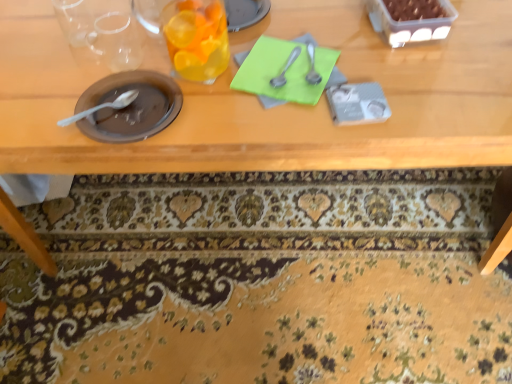
Image resolution: width=512 pixels, height=384 pixels. Describe the element at coordinates (287, 71) in the screenshot. I see `green paper at center` at that location.

What do you see at coordinates (312, 66) in the screenshot? I see `satin silver spoon at upper center, the 4th tableware when ordered from left to right` at bounding box center [312, 66].

The width and height of the screenshot is (512, 384). Describe the element at coordinates (196, 38) in the screenshot. I see `translucent glass at upper center, which is the 3th tableware from right to left` at that location.

Measure the distance between point (292, 112) and camera.

A distance of 29.17 inches exists between point (292, 112) and camera.

Find the location of a particular element. green paper at center is located at coordinates (287, 71).

Is satin silver spoon at upper center, the first tableware in the right-to-left sequence, closer to the viewer compared to matte brown plate at left, the fourth tableware viewed from the right?

No.

At what (x,y) coordinates should I click in order to perform the action: click on tableware that is the 2nd one when counting forward from the satin silver spoon at upper center, the first tableware in the right-to-left sequence. Please return your answer as a coordinate pair (x, y). This screenshot has width=512, height=384. Looking at the image, I should click on (130, 107).

Is satin silver spoon at upper center, the 4th tableware when ordered from left to right, to the left or to the right of matte brown plate at left, the first tableware viewed from the left, in the image?

Clearly, satin silver spoon at upper center, the 4th tableware when ordered from left to right, is on the right of matte brown plate at left, the first tableware viewed from the left, in the image.

Can translucent glass at upper center, the second tableware when ordered from left to right, be found inside wooden table at center?

Definitely not — translucent glass at upper center, the second tableware when ordered from left to right, is not inside wooden table at center.

From a real-world perspective, who is located lower, wooden table at center or translucent glass at upper center, the second tableware when ordered from left to right?

wooden table at center is physically lower.

Between wooden table at center and translucent glass at upper center, the second tableware when ordered from left to right, which one appears on the right side from the viewer's perspective?

wooden table at center is more to the right.

Is green paper at center positioned with its back to wooden table at center?

That's right, green paper at center is facing away from wooden table at center.

Is green paper at center bigger than wooden table at center?

No.

In the scene shown: Which object is positioned more to the left, green paper at center or wooden table at center?

wooden table at center is more to the left.

Considering the points (265, 49) and (381, 150), which point is in front, point (265, 49) or point (381, 150)?

Point (381, 150)

Is translucent glass at upper center, the second tableware when ordered from left to right, far from satin silver spoon at upper center, the first tableware in the right-to-left sequence?

They are positioned close to each other.

Is translucent glass at upper center, the second tableware when ordered from left to right, taller or shorter than satin silver spoon at upper center, the first tableware in the right-to-left sequence?

Result: In the image, translucent glass at upper center, the second tableware when ordered from left to right, appears to be taller than satin silver spoon at upper center, the first tableware in the right-to-left sequence.

Is translucent glass at upper center, which is the 3th tableware from right to left, inside or outside of satin silver spoon at upper center, the first tableware in the right-to-left sequence?

translucent glass at upper center, which is the 3th tableware from right to left, is located beyond the bounds of satin silver spoon at upper center, the first tableware in the right-to-left sequence.

The image size is (512, 384). What are the coordinates of `the 1st tableware below the translucent glass at upper center, the second tableware when ordered from left to right (from the image's perspective)` in the screenshot? It's located at pos(312,66).

Is wooden table at center inside or outside of satin silver spoon at upper center, the 4th tableware when ordered from left to right?

wooden table at center cannot be found inside satin silver spoon at upper center, the 4th tableware when ordered from left to right.

How many degrees apart are the facing directions of wooden table at center and satin silver spoon at upper center, the 4th tableware when ordered from left to right?

The angle between the facing direction of wooden table at center and the facing direction of satin silver spoon at upper center, the 4th tableware when ordered from left to right, is 3.06 degrees.

Which point is more distant from viewer, (449,47) or (309,76)?

Point (449,47)

From the image's perspective, which one is positioned lower, wooden table at center or satin silver spoon at upper center, the 4th tableware when ordered from left to right?

wooden table at center appears lower in the image.

Considering the relative sizes of matte brown plate at left, the fourth tableware viewed from the right, and green paper at center in the image provided, is matte brown plate at left, the fourth tableware viewed from the right, thinner than green paper at center?

Correct, the width of matte brown plate at left, the fourth tableware viewed from the right, is less than that of green paper at center.

From a real-world perspective, who is located higher, matte brown plate at left, the fourth tableware viewed from the right, or green paper at center?

In real-world perspective, matte brown plate at left, the fourth tableware viewed from the right, is above.

Which of these two, matte brown plate at left, the first tableware viewed from the left, or green paper at center, stands shorter?

matte brown plate at left, the first tableware viewed from the left, is shorter.

Which is in front, point (122, 129) or point (285, 90)?

Point (122, 129)

Is green paper at center facing away from translucent glass at upper center, the second tableware when ordered from left to right?

That's not correct — green paper at center is not looking away from translucent glass at upper center, the second tableware when ordered from left to right.

Where is `notepad that is on the right side of translucent glass at upper center, the second tableware when ordered from left to right`? notepad that is on the right side of translucent glass at upper center, the second tableware when ordered from left to right is located at coordinates (287, 71).

Based on their sizes in the image, would you say green paper at center is bigger or smaller than translucent glass at upper center, the second tableware when ordered from left to right?

Considering their sizes, green paper at center takes up less space than translucent glass at upper center, the second tableware when ordered from left to right.

From the image's perspective, which is below, green paper at center or translucent glass at upper center, the second tableware when ordered from left to right?

green paper at center appears lower in the image.

Find the location of a particular element. tableware that is the 3rd object to the right of the matte brown plate at left, the fourth tableware viewed from the right, starting at the anchor is located at coordinates (312, 66).

This screenshot has height=384, width=512. There is a wooden table at center. Find the location of `the 4th tableware above it (from a real-world perspective)`. the 4th tableware above it (from a real-world perspective) is located at coordinates (196, 38).

Looking at the image, which one is located closer to satin silver spoon at center, which is the second tableware from right to left, translucent glass at upper center, which is the 3th tableware from right to left, or satin silver spoon at upper center, the first tableware in the right-to-left sequence?

Based on the image, satin silver spoon at upper center, the first tableware in the right-to-left sequence, appears to be nearer to satin silver spoon at center, which is the second tableware from right to left.

Looking at the image, which one is located closer to translucent glass at upper center, which is the 3th tableware from right to left, green paper at center or satin silver spoon at center, which is the second tableware from right to left?

Based on the image, green paper at center appears to be nearer to translucent glass at upper center, which is the 3th tableware from right to left.

From the image, which object appears to be farther from wooden table at center, satin silver spoon at center, positioned as the third tableware in left-to-right order, or floral carpet at lower center?

floral carpet at lower center.

Which object lies further to the anchor point translucent glass at upper center, the second tableware when ordered from left to right, satin silver spoon at upper center, the 4th tableware when ordered from left to right, or floral carpet at lower center?

Based on the image, floral carpet at lower center appears to be further to translucent glass at upper center, the second tableware when ordered from left to right.

Looking at this image, looking at the image, which one is located further to satin silver spoon at upper center, the 4th tableware when ordered from left to right, translucent glass at upper center, which is the 3th tableware from right to left, or floral carpet at lower center?

The object further to satin silver spoon at upper center, the 4th tableware when ordered from left to right, is floral carpet at lower center.

When comparing their distances from wooden table at center, does translucent glass at upper center, the second tableware when ordered from left to right, or matte brown plate at left, the fourth tableware viewed from the right, seem further?

translucent glass at upper center, the second tableware when ordered from left to right, is further to wooden table at center.

Looking at the image, which one is located further to satin silver spoon at center, which is the second tableware from right to left, floral carpet at lower center or translucent glass at upper center, the second tableware when ordered from left to right?

floral carpet at lower center is positioned further to the anchor satin silver spoon at center, which is the second tableware from right to left.

When comparing their distances from wooden table at center, does green paper at center or matte brown plate at left, the fourth tableware viewed from the right, seem further?

matte brown plate at left, the fourth tableware viewed from the right, is positioned further to the anchor wooden table at center.

Find the location of `notepad between satin silver spoon at center, which is the second tableware from right to left, and satin silver spoon at upper center, the 4th tableware when ordered from left to right, in the horizontal direction`. notepad between satin silver spoon at center, which is the second tableware from right to left, and satin silver spoon at upper center, the 4th tableware when ordered from left to right, in the horizontal direction is located at coordinates (287, 71).

At what (x,y) coordinates should I click in order to perform the action: click on table located between matte brown plate at left, the fourth tableware viewed from the right, and satin silver spoon at center, which is the second tableware from right to left, in the left-right direction. Please return your answer as a coordinate pair (x, y). Looking at the image, I should click on (x=276, y=107).

Where is `notepad located between translucent glass at upper center, the second tableware when ordered from left to right, and satin silver spoon at upper center, the first tableware in the right-to-left sequence, in the left-right direction`? notepad located between translucent glass at upper center, the second tableware when ordered from left to right, and satin silver spoon at upper center, the first tableware in the right-to-left sequence, in the left-right direction is located at coordinates (287, 71).

Find the location of a particular element. table between green paper at center and floral carpet at lower center in the up-down direction is located at coordinates (276, 107).